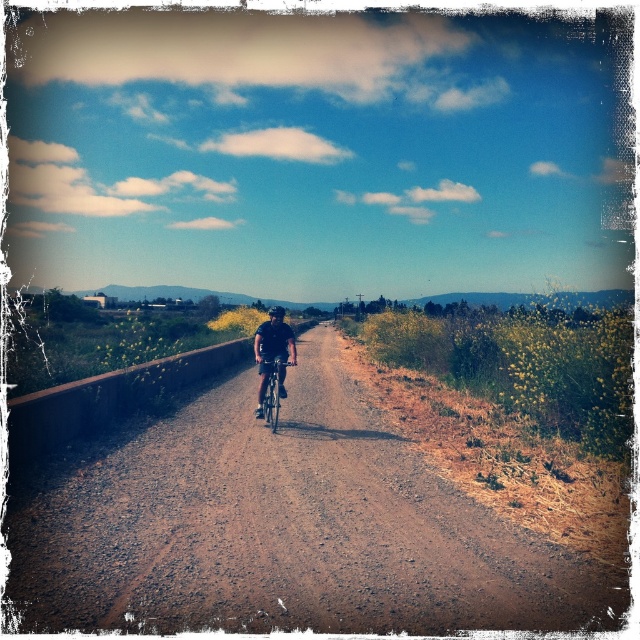
You are a cyclist preparing to ride down the path. You notice the brown gravel road at center and the black matte bicycle helmet at center. Which object is positioned lower from your perspective?

The brown gravel road at center is positioned below the black matte bicycle helmet at center, so the brown gravel road at center is lower.

You are standing at the starting point of the brown gravel road at center. If you walk straight ahead, how far will you be from the road after taking 10 steps?

The brown gravel road at center is 16.20 feet away from the viewer. Assuming an average step length of 2.5 feet, 10 steps would cover 25 feet. Since the road is only 16.20 feet away, you would have passed it and be 8.8 feet beyond the road after 10 steps.